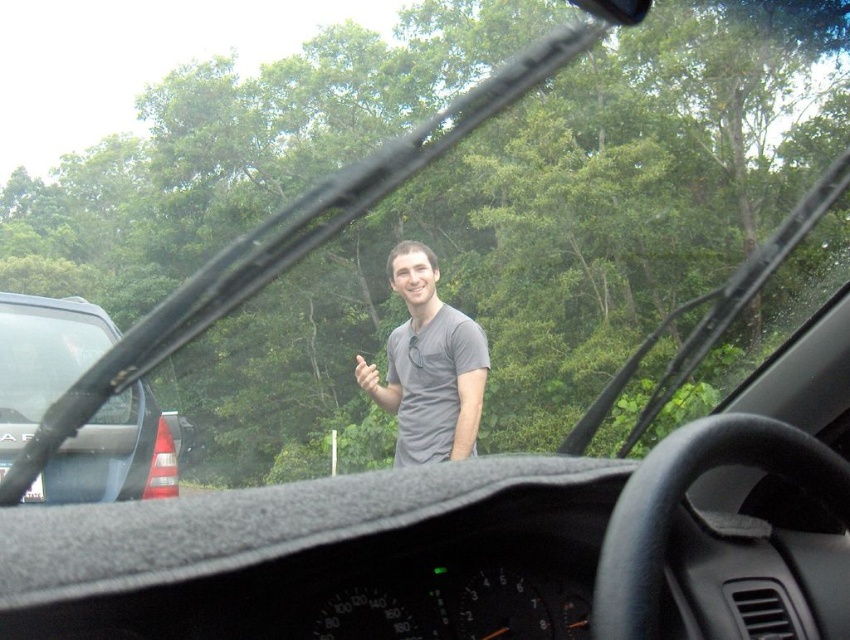
Who is shorter, satin black car at left or gray matte shirt at center?

Standing shorter between the two is satin black car at left.

What do you see at coordinates (42, 358) in the screenshot? The width and height of the screenshot is (850, 640). I see `satin black car at left` at bounding box center [42, 358].

This screenshot has width=850, height=640. Identify the location of satin black car at left. (42, 358).

Does gray matte shirt at center have a lesser width compared to matte gray hand at center?

Indeed, gray matte shirt at center has a lesser width compared to matte gray hand at center.

Is point (391, 349) positioned after point (371, 369)?

Yes, it is.

Is point (411, 339) less distant than point (354, 371)?

That is True.

The width and height of the screenshot is (850, 640). I want to click on gray matte shirt at center, so click(431, 365).

Which is more to the left, satin black car at left or matte gray hand at center?

From the viewer's perspective, matte gray hand at center appears more on the left side.

At what (x,y) coordinates should I click in order to perform the action: click on satin black car at left. Please return your answer as a coordinate pair (x, y). The width and height of the screenshot is (850, 640). Looking at the image, I should click on (42, 358).